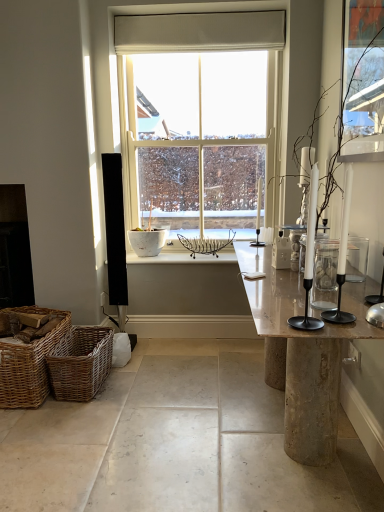
Where is `clear glass jar at right`? clear glass jar at right is located at coordinates (325, 265).

This screenshot has height=512, width=384. Describe the element at coordinates (183, 258) in the screenshot. I see `white marble tray at center` at that location.

Locate an element on the screen. The width and height of the screenshot is (384, 512). white fabric curtain at upper center is located at coordinates (200, 32).

What is the approximate height of black glass fireplace at left?

It is 38.32 inches.

Where is `woven brown picnic basket at lower left, which appears as the first picnic basket when viewed from the left`? woven brown picnic basket at lower left, which appears as the first picnic basket when viewed from the left is located at coordinates (28, 364).

This screenshot has width=384, height=512. I want to click on marble table at center, so click(302, 353).

Can clear glass jar at right be found inside smooth concrete table at lower center?

No, clear glass jar at right is not inside smooth concrete table at lower center.

Does smooth concrete table at lower center have a greater width compared to clear glass jar at right?

Correct, the width of smooth concrete table at lower center exceeds that of clear glass jar at right.

Considering the positions of objects smooth concrete table at lower center and clear glass jar at right in the image provided, who is more to the right, smooth concrete table at lower center or clear glass jar at right?

clear glass jar at right is more to the right.

Is there a large distance between smooth concrete table at lower center and clear glass jar at right?

No, smooth concrete table at lower center is not far from clear glass jar at right.

In terms of width, does smooth concrete table at lower center look wider or thinner when compared to white glossy candle holder at center?

Considering their sizes, smooth concrete table at lower center looks broader than white glossy candle holder at center.

Considering the sizes of objects smooth concrete table at lower center and white glossy candle holder at center in the image provided, who is bigger, smooth concrete table at lower center or white glossy candle holder at center?

Bigger between the two is smooth concrete table at lower center.

Does point (58, 473) appear closer or farther from the camera than point (256, 225)?

Clearly, point (58, 473) is closer to the camera than point (256, 225).

From the picture: From the image's perspective, would you say smooth concrete table at lower center is shown under white glossy candle holder at center?

Indeed, from the image's perspective, smooth concrete table at lower center is shown beneath white glossy candle holder at center.

Can you confirm if white marble tray at center is bigger than woven brown picnic basket at lower left, which appears as the first picnic basket when viewed from the left?

Incorrect, white marble tray at center is not larger than woven brown picnic basket at lower left, which appears as the first picnic basket when viewed from the left.

Can you confirm if white marble tray at center is thinner than woven brown picnic basket at lower left, which appears as the first picnic basket when viewed from the left?

Correct, the width of white marble tray at center is less than that of woven brown picnic basket at lower left, which appears as the first picnic basket when viewed from the left.

How many degrees apart are the facing directions of white marble tray at center and woven brown picnic basket at lower left, which appears as the first picnic basket when viewed from the left?

The angular difference between white marble tray at center and woven brown picnic basket at lower left, which appears as the first picnic basket when viewed from the left, is 0.208 degrees.

Is white marble tray at center taller or shorter than woven brown picnic basket at lower left, the second picnic basket when ordered from right to left?

Clearly, white marble tray at center is shorter compared to woven brown picnic basket at lower left, the second picnic basket when ordered from right to left.

You are a GUI agent. You are given a task and a screenshot of the screen. Output one action in this format:
    pyautogui.click(x=<x>, y=<y>)
    Task: Click on the candle holder on the right side of white marble tray at center
    Image resolution: width=384 pixels, height=512 pixels.
    Given the screenshot: What is the action you would take?
    pyautogui.click(x=258, y=217)

From the image's perspective, which is below, white marble tray at center or white glossy candle holder at center?

white marble tray at center.

Considering the points (191, 261) and (258, 198), which point is in front, point (191, 261) or point (258, 198)?

Positioned in front is point (191, 261).

Would you say woven brown picnic basket at lower left, arranged as the 1th picnic basket when viewed from the right, is a long distance from woven brown picnic basket at lower left, the second picnic basket when ordered from right to left?

No, woven brown picnic basket at lower left, arranged as the 1th picnic basket when viewed from the right, is not far away from woven brown picnic basket at lower left, the second picnic basket when ordered from right to left.

Is point (60, 362) farther from viewer compared to point (35, 379)?

Yes.

Is woven brown picnic basket at lower left, arranged as the 1th picnic basket when viewed from the right, not within woven brown picnic basket at lower left, the second picnic basket when ordered from right to left?

That's correct, woven brown picnic basket at lower left, arranged as the 1th picnic basket when viewed from the right, is outside of woven brown picnic basket at lower left, the second picnic basket when ordered from right to left.

Which object is further away from the camera taking this photo, woven brown picnic basket at lower left, which is counted as the second picnic basket, starting from the left, or woven brown picnic basket at lower left, which appears as the first picnic basket when viewed from the left?

woven brown picnic basket at lower left, which is counted as the second picnic basket, starting from the left, is further away from the camera.

From the image's perspective, is marble table at center over transparent glass window screen at upper right?

No, from the image's perspective, marble table at center is not on top of transparent glass window screen at upper right.

Is transparent glass window screen at upper right surrounded by marble table at center?

No, transparent glass window screen at upper right is not inside marble table at center.

Is point (262, 254) closer to camera compared to point (345, 80)?

No, (262, 254) is further to viewer.

Can you see woven brown picnic basket at lower left, which appears as the first picnic basket when viewed from the left, touching white marble tray at center?

Result: woven brown picnic basket at lower left, which appears as the first picnic basket when viewed from the left, and white marble tray at center are clearly separated.

This screenshot has width=384, height=512. Identify the location of the 2nd picnic basket in front of the white marble tray at center. (28, 364).

Considering the points (37, 360) and (223, 261), which point is in front, point (37, 360) or point (223, 261)?

The point (37, 360) is in front.

Image resolution: width=384 pixels, height=512 pixels. In order to click on concrete in front of the clear glass jar at right in this screenshot , I will do `click(176, 442)`.

Identify the location of concrete that appears on the left of white glossy candle holder at center. Image resolution: width=384 pixels, height=512 pixels. (176, 442).

Based on the photo, estimate the real-world distances between objects in this image. Which object is closer to woven brown picnic basket at lower left, which is counted as the second picnic basket, starting from the left, white glossy candle holder at center or black glass fireplace at left?

Based on the image, black glass fireplace at left appears to be nearer to woven brown picnic basket at lower left, which is counted as the second picnic basket, starting from the left.

Considering their positions, is black glass fireplace at left positioned closer to transparent glass window screen at upper right than marble table at center?

marble table at center lies closer to transparent glass window screen at upper right than the other object.

Consider the image. From the image, which object appears to be farther from smooth concrete table at lower center, white fabric curtain at upper center or white glass window at center?

white fabric curtain at upper center lies further to smooth concrete table at lower center than the other object.

Estimate the real-world distances between objects in this image. Which object is further from woven brown picnic basket at lower left, which appears as the first picnic basket when viewed from the left, white marble tray at center or woven brown picnic basket at lower left, which is counted as the second picnic basket, starting from the left?

The object further to woven brown picnic basket at lower left, which appears as the first picnic basket when viewed from the left, is white marble tray at center.

Looking at this image, from the image, which object appears to be farther from woven brown picnic basket at lower left, the second picnic basket when ordered from right to left, woven brown picnic basket at lower left, arranged as the 1th picnic basket when viewed from the right, or white fabric curtain at upper center?

white fabric curtain at upper center lies further to woven brown picnic basket at lower left, the second picnic basket when ordered from right to left, than the other object.

Based on their spatial positions, is smooth concrete table at lower center or woven brown picnic basket at lower left, the second picnic basket when ordered from right to left, closer to white glass window at center?

woven brown picnic basket at lower left, the second picnic basket when ordered from right to left.

Considering their positions, is woven brown picnic basket at lower left, which appears as the first picnic basket when viewed from the left, positioned further to clear glass jar at right than black glass fireplace at left?

black glass fireplace at left lies further to clear glass jar at right than the other object.

Estimate the real-world distances between objects in this image. Which object is closer to woven brown picnic basket at lower left, the second picnic basket when ordered from right to left, black glass fireplace at left or white marble tray at center?

Among the two, black glass fireplace at left is located nearer to woven brown picnic basket at lower left, the second picnic basket when ordered from right to left.

You are a GUI agent. You are given a task and a screenshot of the screen. Output one action in this format:
    pyautogui.click(x=<x>, y=<y>)
    Task: Click on the curtain between black glass fireplace at left and clear glass jar at right in the horizontal direction
    This screenshot has width=384, height=512.
    Given the screenshot: What is the action you would take?
    (200, 32)

Where is `window between transparent glass window screen at upper right and smooth concrete table at lower center in the up-down direction`? The height and width of the screenshot is (512, 384). window between transparent glass window screen at upper right and smooth concrete table at lower center in the up-down direction is located at coordinates click(197, 118).

At what (x,y) coordinates should I click in order to perform the action: click on window between white fabric curtain at upper center and white marble tray at center in the up-down direction. Please return your answer as a coordinate pair (x, y). The height and width of the screenshot is (512, 384). Looking at the image, I should click on (197, 118).

The image size is (384, 512). In order to click on glass vase between marble table at center and white glossy candle holder at center from front to back in this screenshot , I will do `click(325, 265)`.